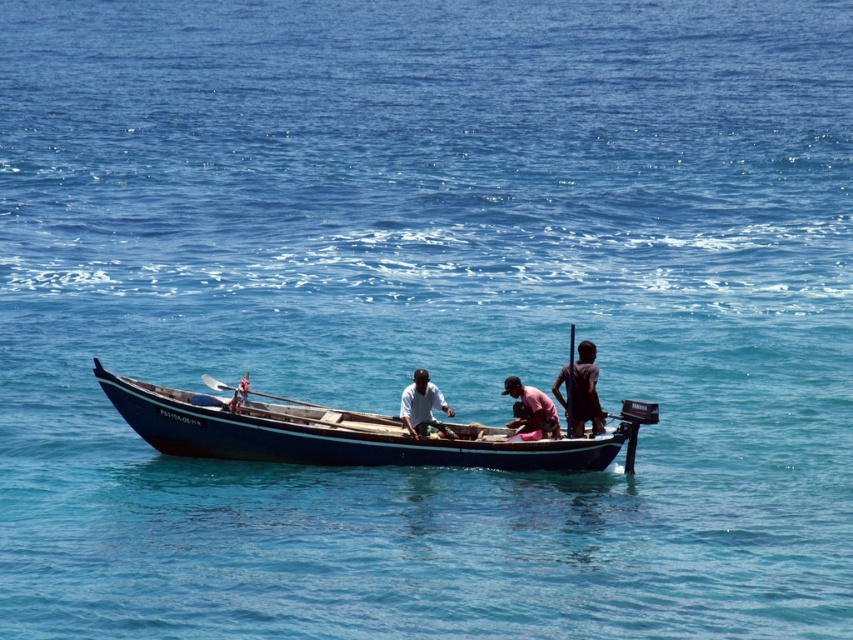
You are standing on the deck of the boat and want to hand a fishing rod to the person wearing the white matte shirt at center. Based on their position, where should you aim to pass the rod?

The white matte shirt at center is located at point (422, 406), so you should aim towards that coordinate to pass the fishing rod.

You are a passenger on the blue polished wood boat at center and want to hand a fishing rod to the person wearing the white matte shirt at center. Can you reach them without moving from your current position if your arm can extend 1.5 meters?

The distance between the blue polished wood boat at center and the white matte shirt at center is 1.74 meters. Since your arm can only extend 1.5 meters, you cannot reach them without moving.